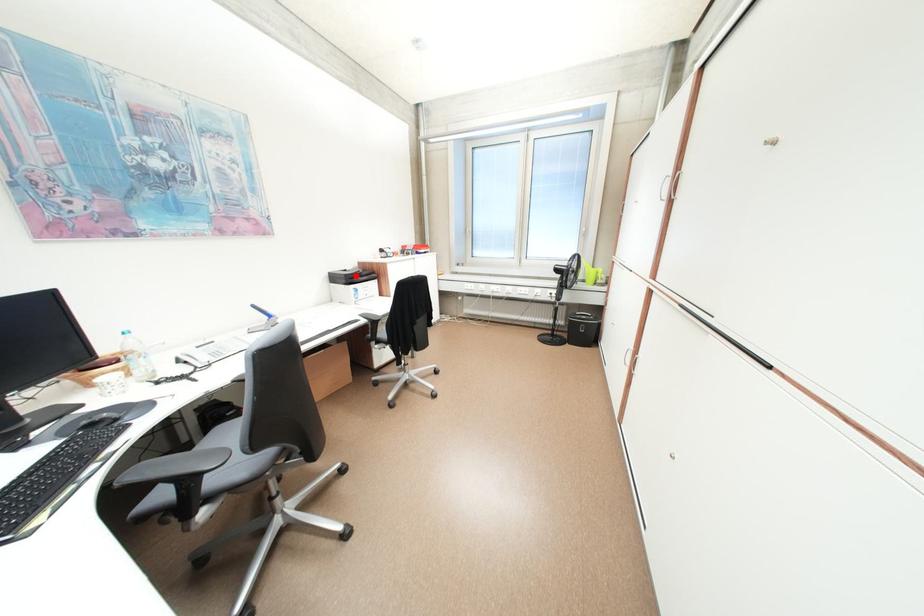
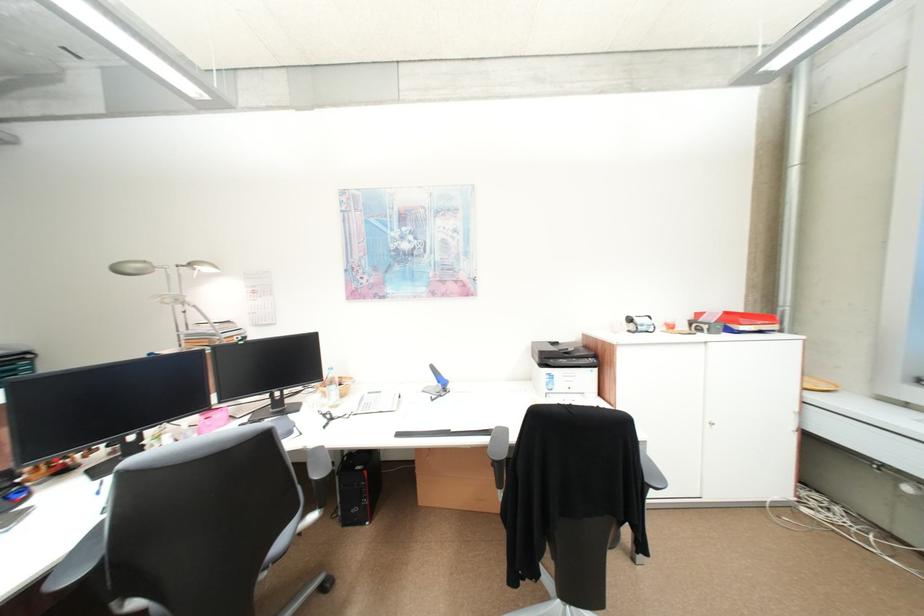
Question: A red point is marked in image1. In image2, is the corresponding 3D point closer to the camera or farther? Reply with the corresponding letter.

Choices:
 (A) The corresponding 3D point is closer.
 (B) The corresponding 3D point is farther.

Answer: (B)